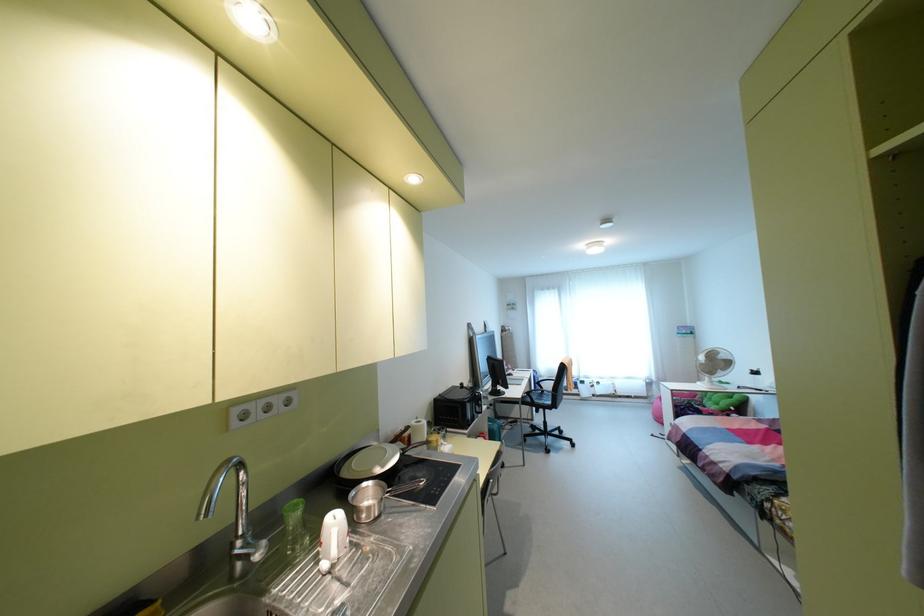
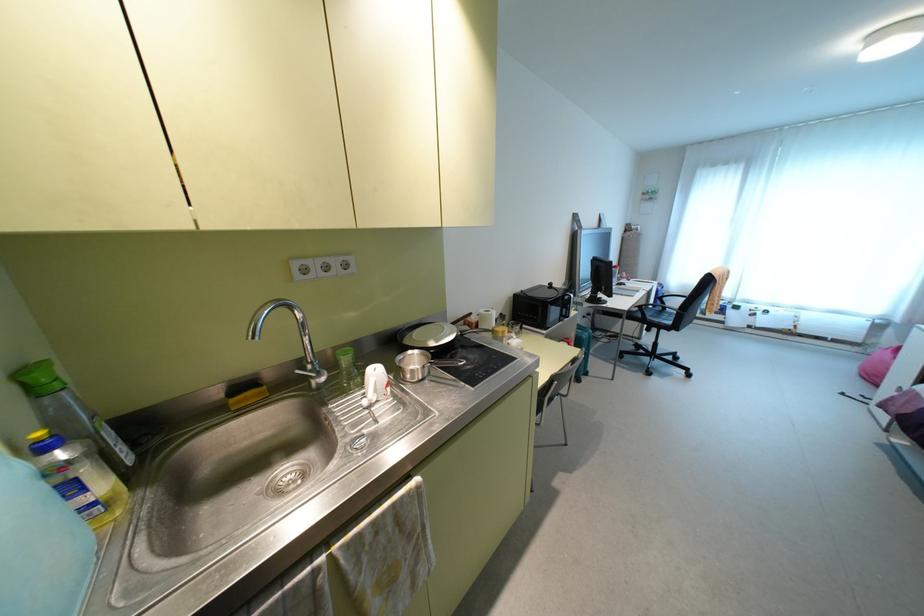
Locate, in the second image, the point that corresponds to (433,437) in the first image.

(500, 328)